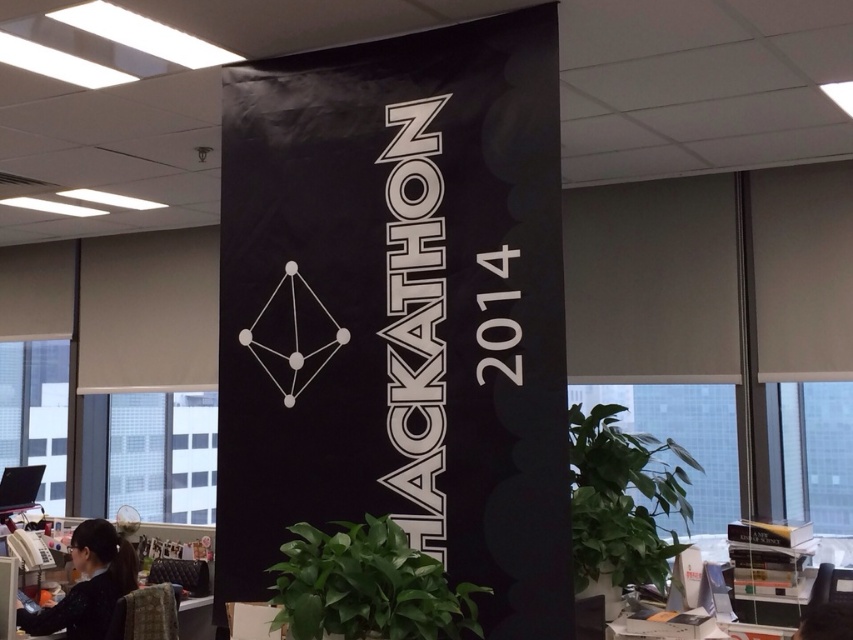
Question: Estimate the real-world distances between objects in this image. Which object is farther from the black hair at lower left?

Choices:
 (A) black matte banner at center
 (B) green leafy plant at lower center
 (C) green leafy plant at right

Answer: (C)

Question: Considering the real-world distances, which object is closest to the black matte banner at center?

Choices:
 (A) green leafy plant at lower center
 (B) black hair at lower left
 (C) green leafy plant at right

Answer: (A)

Question: Is green leafy plant at lower center thinner than green leafy plant at right?

Choices:
 (A) yes
 (B) no

Answer: (A)

Question: Is the position of green leafy plant at lower center less distant than that of green leafy plant at right?

Choices:
 (A) yes
 (B) no

Answer: (A)

Question: Is black matte banner at center above black hair at lower left?

Choices:
 (A) no
 (B) yes

Answer: (B)

Question: Which point is farther to the camera?

Choices:
 (A) green leafy plant at right
 (B) black matte banner at center
 (C) black hair at lower left
 (D) green leafy plant at lower center

Answer: (C)